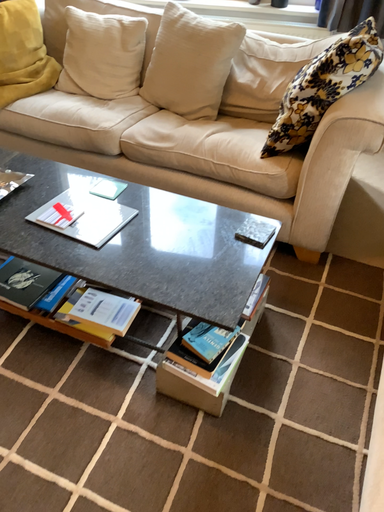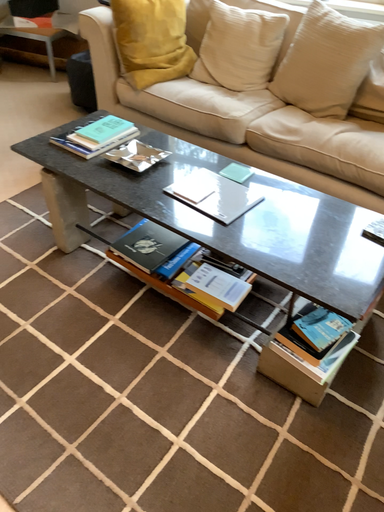
Question: Which way did the camera rotate in the video?

Choices:
 (A) rotated left
 (B) rotated right

Answer: (A)